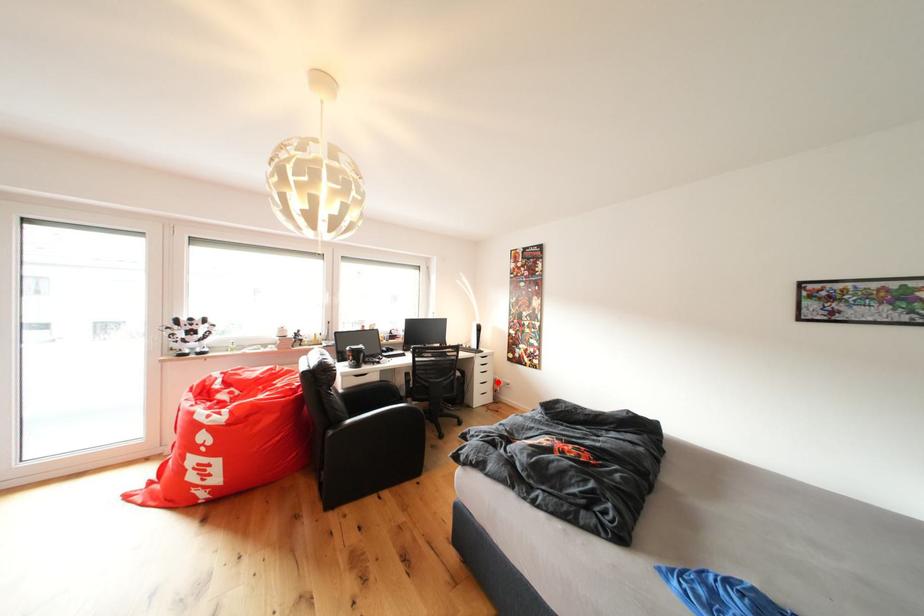
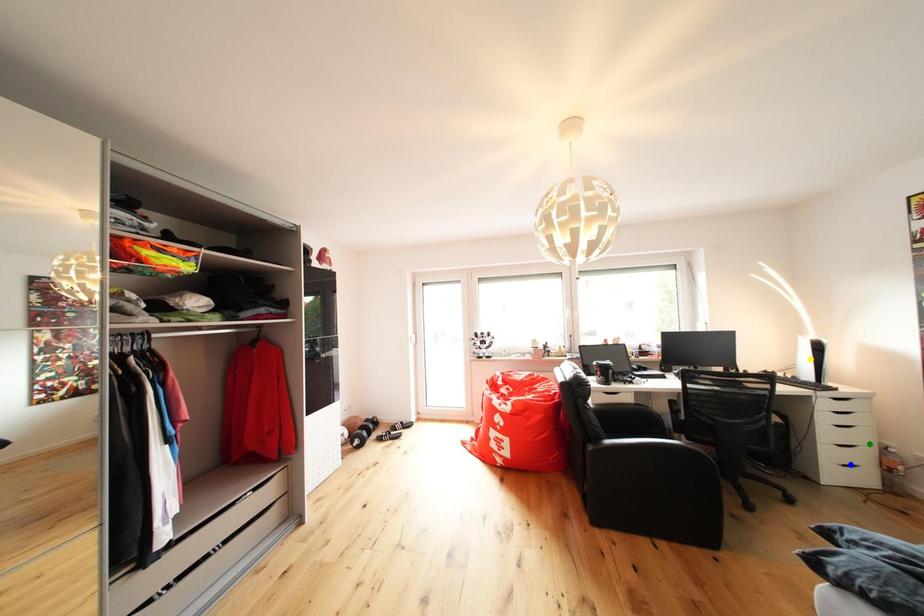
Question: I am providing you with two images of the same scene from different viewpoints. A red point is marked on the first image. You are given multiple points on the second image. Which point in image 2 is actually the same real-world point as the red point in image 1?

Choices:
 (A) green point
 (B) blue point
 (C) yellow point

Answer: (A)